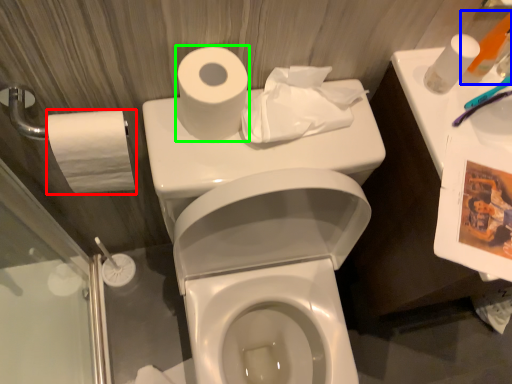
Question: Which object is positioned closest to toilet paper (highlighted by a red box)? Select from toiletry (highlighted by a blue box) and toilet paper (highlighted by a green box).

Choices:
 (A) toiletry
 (B) toilet paper

Answer: (B)